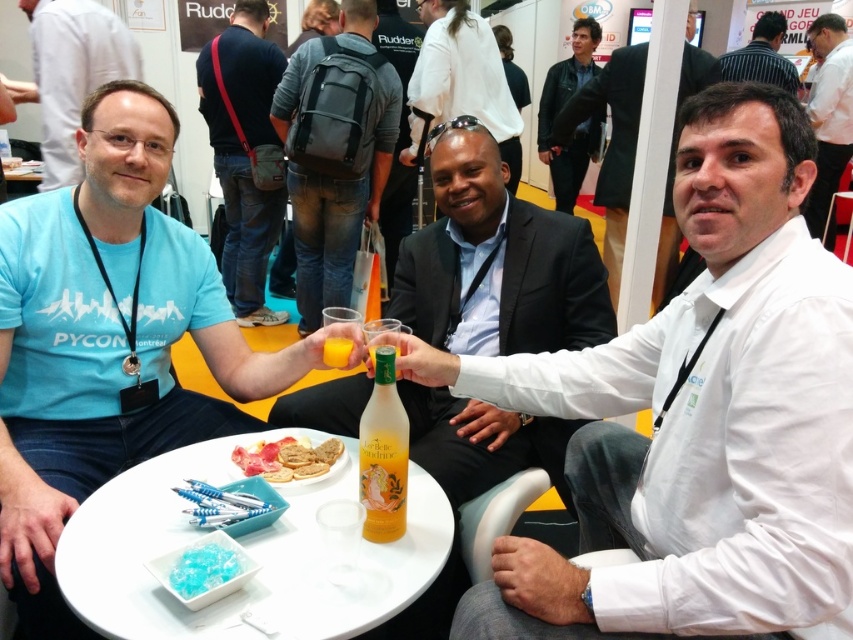
Does point (38, 547) lie behind point (374, 216)?

No, (38, 547) is closer to viewer.

Which is below, matte blue t-shirt at left or matte black backpack at center?

matte blue t-shirt at left is below.

Is point (163, 333) positioned before point (308, 205)?

Yes, point (163, 333) is closer to viewer.

The image size is (853, 640). I want to click on matte blue t-shirt at left, so click(106, 340).

Does point (753, 449) lie behind point (724, 68)?

No, it is not.

The width and height of the screenshot is (853, 640). In order to click on white glossy bottle at center in this screenshot , I will do `click(695, 419)`.

Between white plastic table at center and dark suit at center, which one is positioned higher?

Positioned higher is dark suit at center.

At what (x,y) coordinates should I click in order to perform the action: click on white plastic table at center. Please return your answer as a coordinate pair (x, y). The width and height of the screenshot is (853, 640). Looking at the image, I should click on (247, 550).

The height and width of the screenshot is (640, 853). Find the location of `white plastic table at center`. white plastic table at center is located at coordinates pyautogui.click(x=247, y=550).